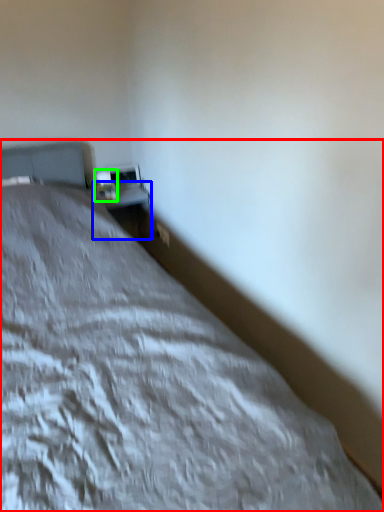
Question: Which object is the closest to the bed (highlighted by a red box)? Choose among these: table (highlighted by a blue box) or table lamp (highlighted by a green box).

Choices:
 (A) table
 (B) table lamp

Answer: (B)